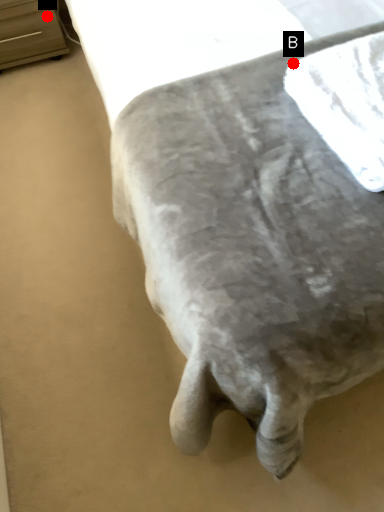
Question: Two points are circled on the image, labeled by A and B beside each circle. Which of the following is the closest to the observer?

Choices:
 (A) A is closer
 (B) B is closer

Answer: (B)